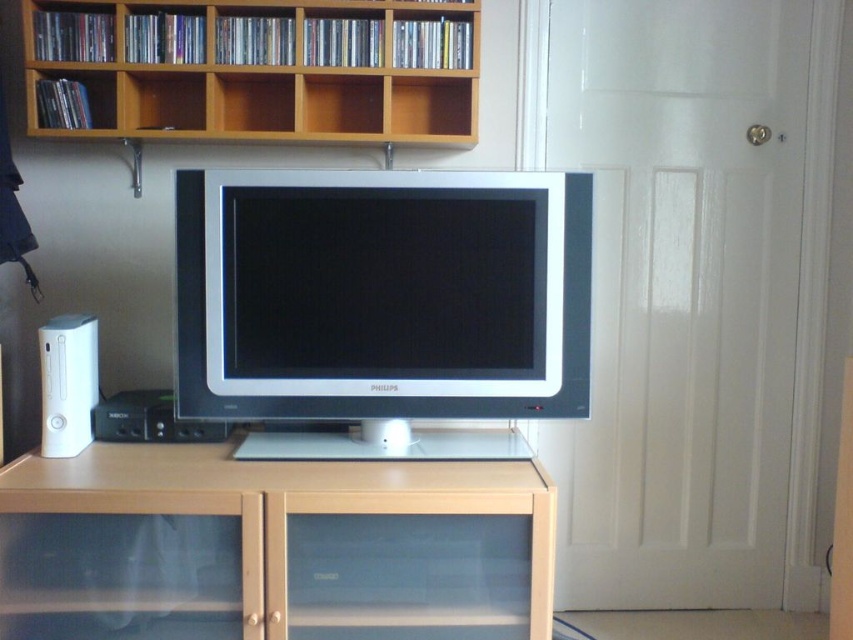
You are a technician who needs to install a new speaker that is 15 inches wide. You see the beige wood cabinet at center and the white plastic speaker at left. Can the new speaker fit between them?

The distance between the beige wood cabinet at center and the white plastic speaker at left is 14.95 inches. Since the new speaker is 15 inches wide, it cannot fit between them as the space is slightly smaller than the speaker.

You are setting up a new speaker system and need to place it between the satin silver monitor at center and the beige wood cabinet at center. The speaker requires a minimum of 14 inches of space to function properly. Based on the setup shown, will there be enough space for the speaker?

The satin silver monitor at center is 12.38 inches away from beige wood cabinet at center. Since the required space is 14 inches, there is insufficient space for the speaker to function properly.